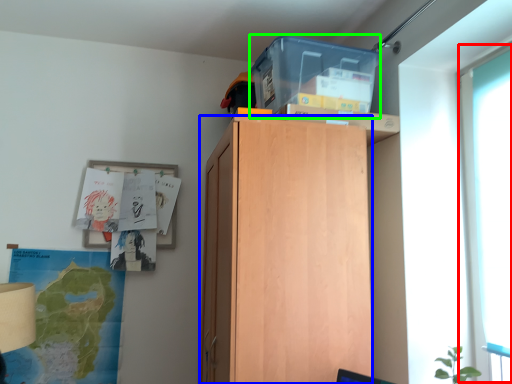
Question: Which object is the farthest from glass door (highlighted by a red box)? Choose among these: cabinetry (highlighted by a blue box) or storage box (highlighted by a green box).

Choices:
 (A) cabinetry
 (B) storage box

Answer: (A)